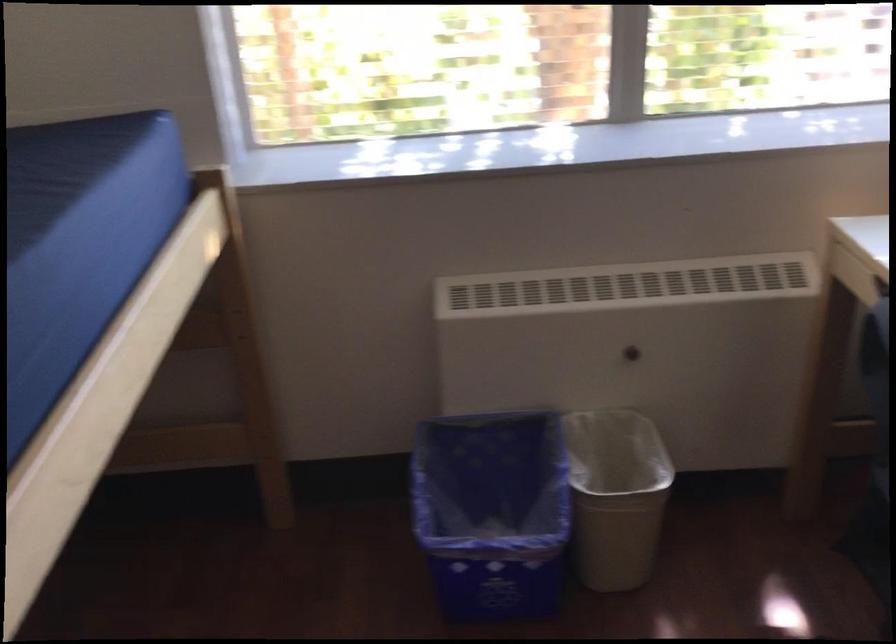
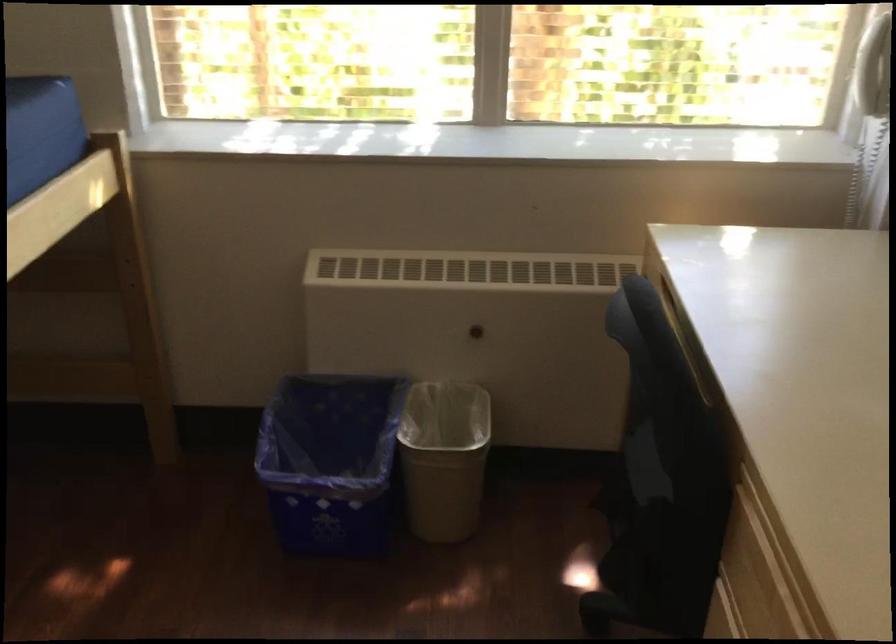
Locate, in the second image, the point that corresponds to point 633,500 in the first image.

(444, 458)